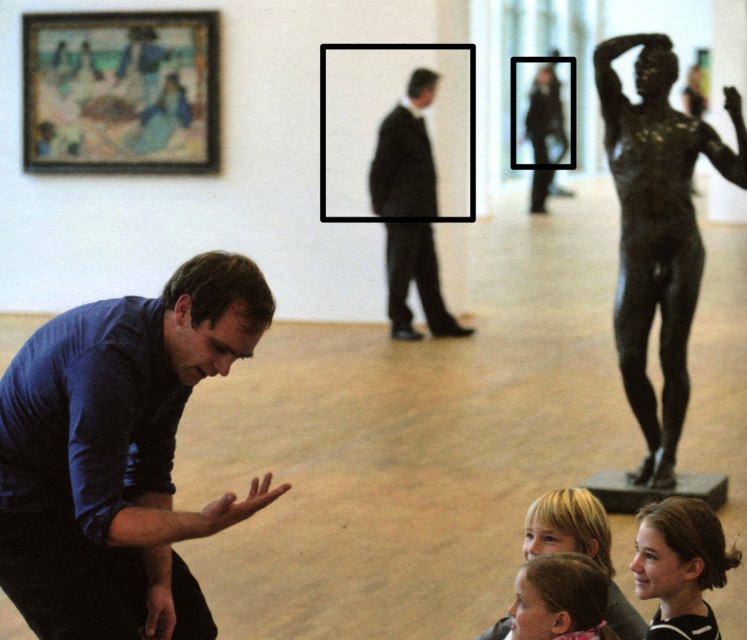
You are an art student trying to sketch the scene. You need to place the blue matte shirt at lower left in your drawing. According to the coordinates provided, where should you position it on your paper?

The blue matte shirt at lower left should be positioned at coordinates point (117, 454).

You are a visitor in the art gallery and want to take a photo of the bronze statue at right without including the blue matte shirt at lower left in the frame. Is this possible?

The blue matte shirt at lower left is positioned under the bronze statue at right, so if you angle your camera to focus on the upper part of the bronze statue at right while avoiding the lower area where the blue matte shirt at lower left is located, you can take a photo of the bronze statue at right without including the blue matte shirt at lower left.

You are standing in the art gallery and see the blue matte shirt at lower left and the blonde hair at lower center. Which object is positioned to the left of the other?

The blue matte shirt at lower left is to the left of blonde hair at lower center.